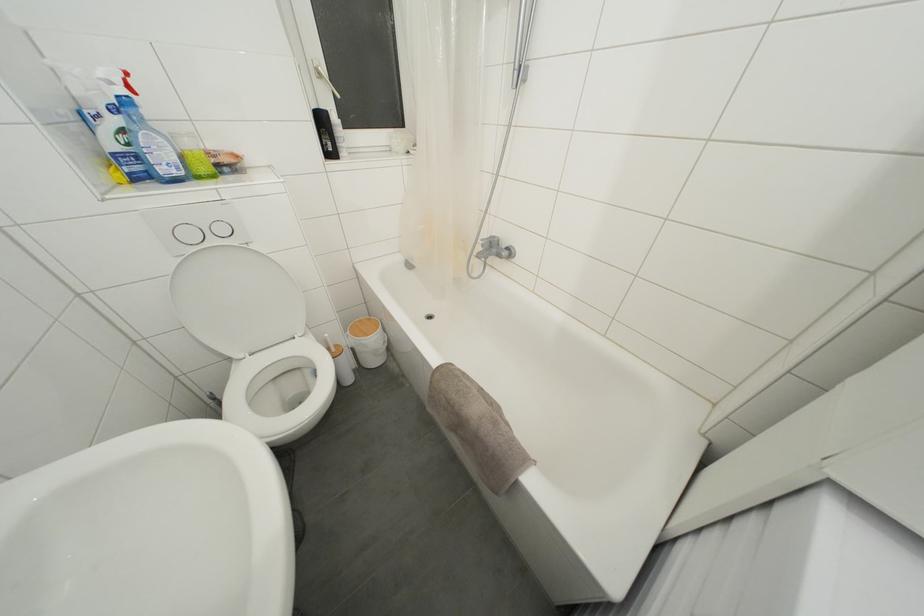
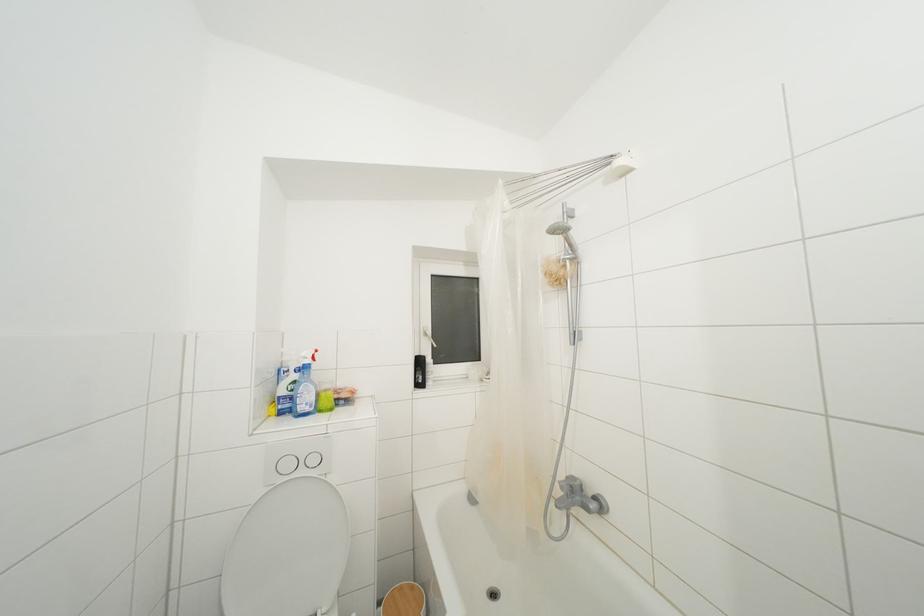
How did the camera likely rotate?

The rotation direction of the camera is left-up.